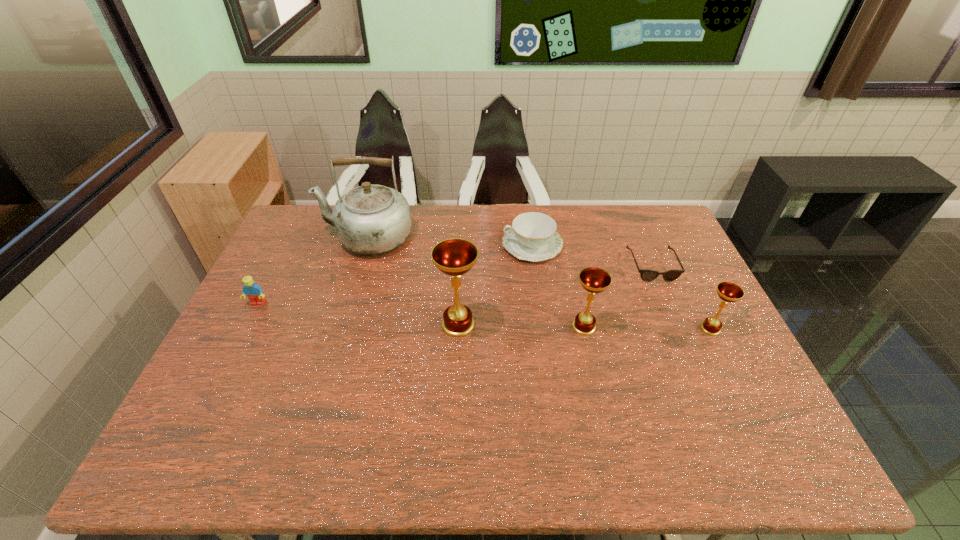
I want to click on vacant place for an extra chalice on the left, so click(333, 323).